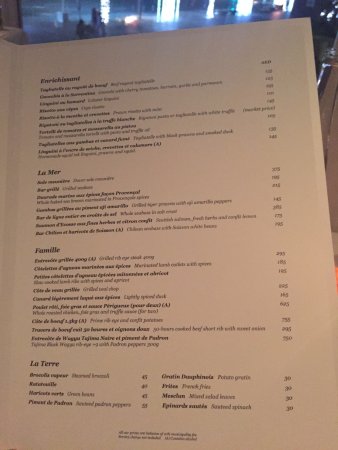
What are the coordinates of `restaurant menu` in the screenshot? It's located at (211, 281).